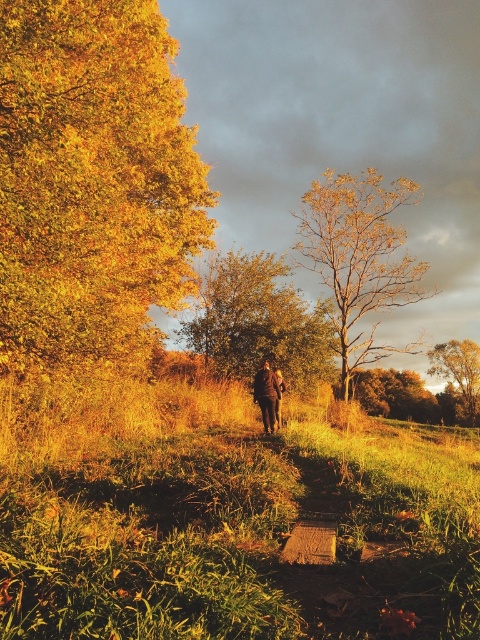
You are a hiker walking along the grassy path and see the golden leafy tree at left and the golden textured tree at center. Which tree is closer to your left side?

The golden leafy tree at left is closer to your left side because it is positioned to the left of the golden textured tree at center.